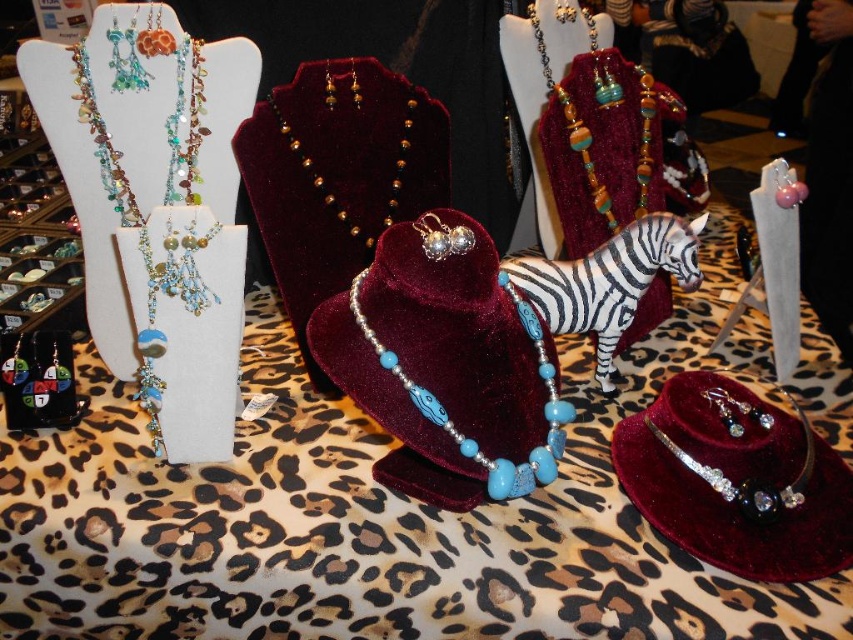
Can you confirm if turquoise glass beads at center is thinner than turquoise beaded necklace at center?

No, turquoise glass beads at center is not thinner than turquoise beaded necklace at center.

Consider the image. Is turquoise glass beads at center taller than turquoise beaded necklace at center?

No.

Does point (503, 284) lie in front of point (585, 157)?

Yes, point (503, 284) is in front of point (585, 157).

Where is `turquoise glass beads at center`? turquoise glass beads at center is located at coordinates (469, 436).

Locate an element on the screen. gold beaded necklace at center is located at coordinates (318, 179).

Is gold beaded necklace at center to the left of turquoise beaded necklace at center from the viewer's perspective?

Indeed, gold beaded necklace at center is positioned on the left side of turquoise beaded necklace at center.

The image size is (853, 640). Describe the element at coordinates (318, 179) in the screenshot. I see `gold beaded necklace at center` at that location.

This screenshot has width=853, height=640. I want to click on gold beaded necklace at center, so click(x=318, y=179).

This screenshot has width=853, height=640. What do you see at coordinates (170, 272) in the screenshot?
I see `matte blue beaded necklace at left` at bounding box center [170, 272].

Which is in front, point (180, 371) or point (289, 131)?

Positioned in front is point (180, 371).

Is point (231, 428) positioned before point (325, 104)?

Yes, point (231, 428) is closer to viewer.

What are the coordinates of `matte blue beaded necklace at left` in the screenshot? It's located at (170, 272).